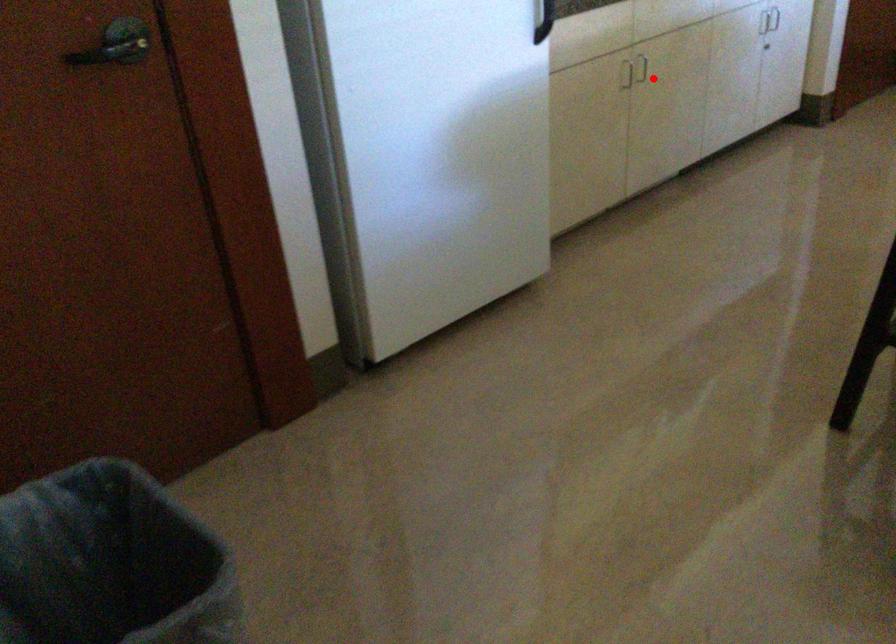
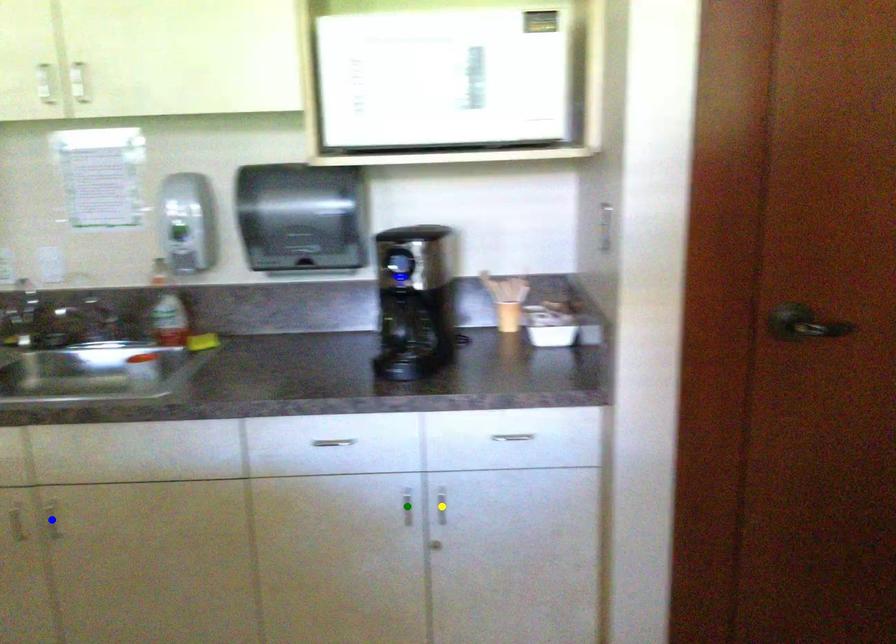
Question: I am providing you with two images of the same scene from different viewpoints. A red point is marked on the first image. You are given multiple points on the second image. Can you choose the point in image 2 that corresponds to the point in image 1?

Choices:
 (A) yellow point
 (B) blue point
 (C) green point

Answer: (B)